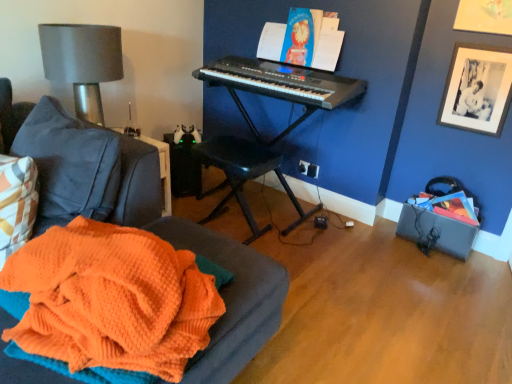
Question: From a real-world perspective, is black plastic keyboard at upper center physically below black plastic music stool at center?

Choices:
 (A) yes
 (B) no

Answer: (B)

Question: Is black plastic keyboard at upper center oriented towards black plastic music stool at center?

Choices:
 (A) yes
 (B) no

Answer: (B)

Question: From the image's perspective, is black plastic keyboard at upper center over black plastic music stool at center?

Choices:
 (A) yes
 (B) no

Answer: (A)

Question: Does black plastic keyboard at upper center contain black plastic music stool at center?

Choices:
 (A) yes
 (B) no

Answer: (B)

Question: Are black plastic keyboard at upper center and black plastic music stool at center far apart?

Choices:
 (A) yes
 (B) no

Answer: (B)

Question: Is black plastic keyboard at upper center further to camera compared to black plastic music stool at center?

Choices:
 (A) no
 (B) yes

Answer: (B)

Question: Is black plastic keyboard at center closer to the viewer compared to matte blue book at upper center?

Choices:
 (A) yes
 (B) no

Answer: (A)

Question: From a real-world perspective, is black plastic keyboard at center over matte blue book at upper center?

Choices:
 (A) no
 (B) yes

Answer: (A)

Question: Can you confirm if black plastic keyboard at center is thinner than matte blue book at upper center?

Choices:
 (A) yes
 (B) no

Answer: (B)

Question: From the image's perspective, would you say black plastic keyboard at center is shown under matte blue book at upper center?

Choices:
 (A) no
 (B) yes

Answer: (B)

Question: Is black plastic keyboard at center smaller than matte blue book at upper center?

Choices:
 (A) no
 (B) yes

Answer: (A)

Question: Can you confirm if black plastic keyboard at center is shorter than matte blue book at upper center?

Choices:
 (A) no
 (B) yes

Answer: (A)

Question: Is the position of black plastic keyboard at center less distant than that of orange knitted blanket at lower left?

Choices:
 (A) no
 (B) yes

Answer: (A)